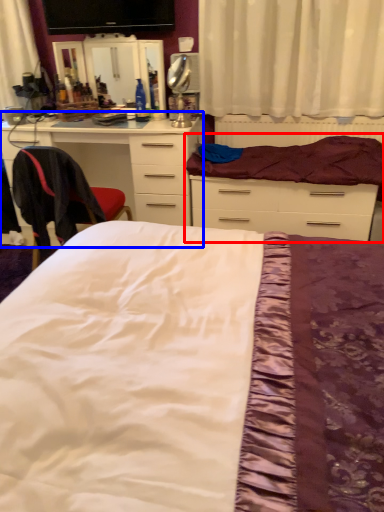
Question: Which object appears farthest to the camera in this image, bed (highlighted by a red box) or chest of drawers (highlighted by a blue box)?

Choices:
 (A) bed
 (B) chest of drawers

Answer: (B)